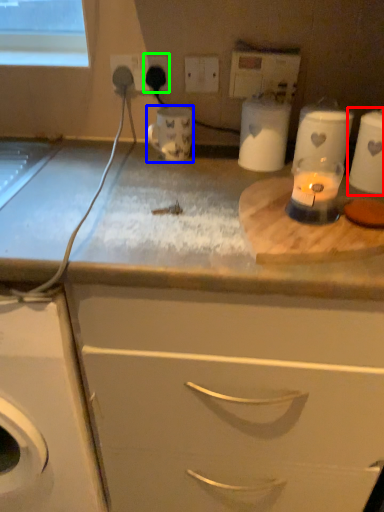
Question: Based on their relative distances, which object is nearer to appliance (highlighted by a red box)? Choose from appliance (highlighted by a blue box) and electric outlet (highlighted by a green box).

Choices:
 (A) appliance
 (B) electric outlet

Answer: (A)